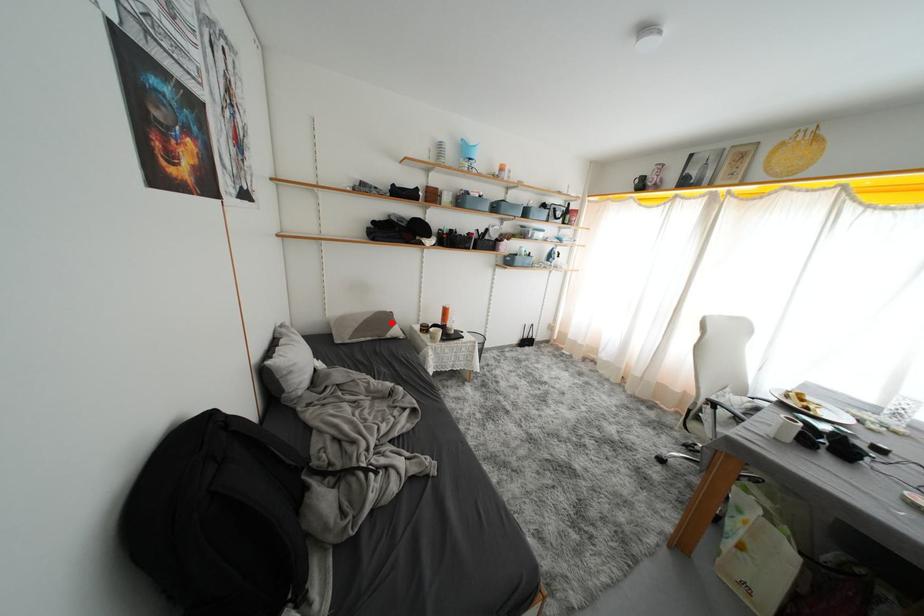
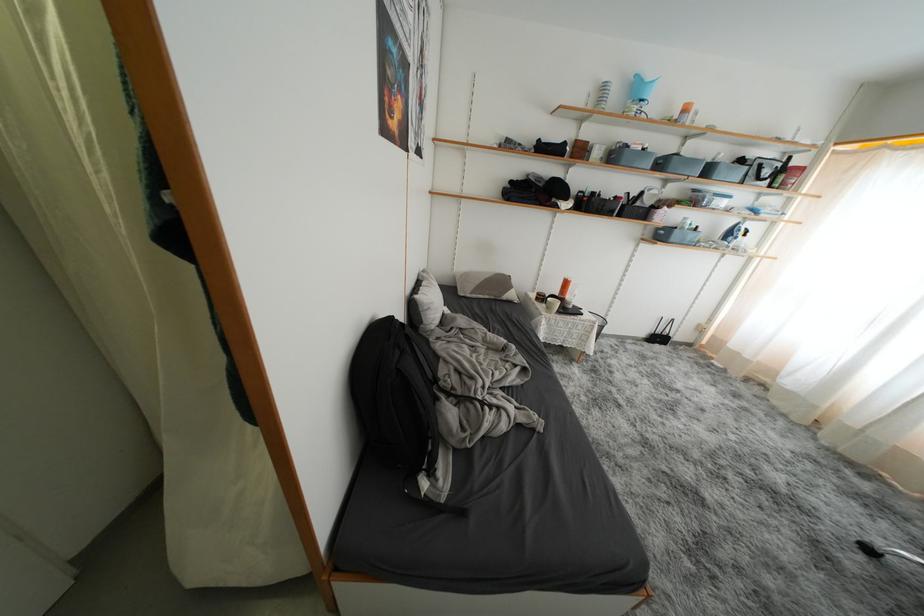
The point at the highlighted location is marked in the first image. Where is the corresponding point in the second image?

(508, 286)